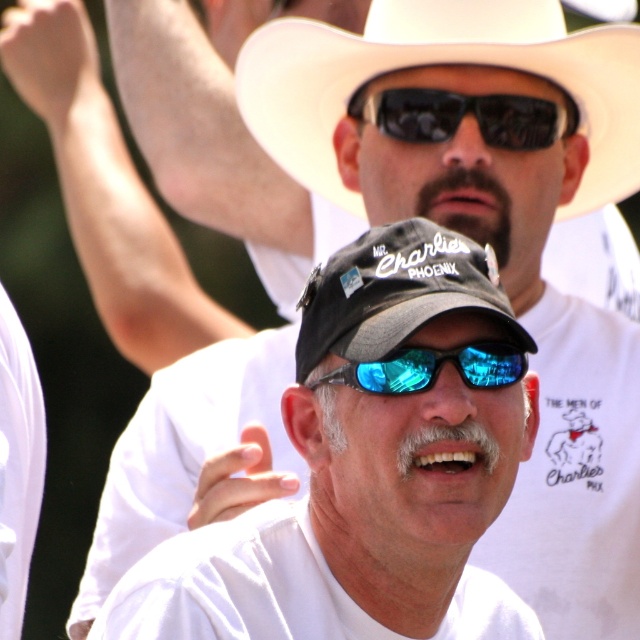
Question: Which object appears closest to the camera in this image?

Choices:
 (A) white matte cowboy hat at upper center
 (B) blue reflective lens goggles at center

Answer: (B)

Question: Which point is closer to the camera taking this photo?

Choices:
 (A) (355, 276)
 (B) (440, 365)
 (C) (493, 141)

Answer: (B)

Question: Among these objects, which one is nearest to the camera?

Choices:
 (A) blue reflective lens goggles at center
 (B) white matte cowboy hat at upper center
 (C) black matte cap at center
 (D) black fabric baseball cap at center

Answer: (C)

Question: Is black matte cap at center thinner than black reflective sunglasses at center?

Choices:
 (A) no
 (B) yes

Answer: (A)

Question: Is white matte cowboy hat at upper center positioned before black reflective sunglasses at center?

Choices:
 (A) yes
 (B) no

Answer: (A)

Question: Can you confirm if black matte cap at center is positioned to the left of black fabric baseball cap at center?

Choices:
 (A) yes
 (B) no

Answer: (A)